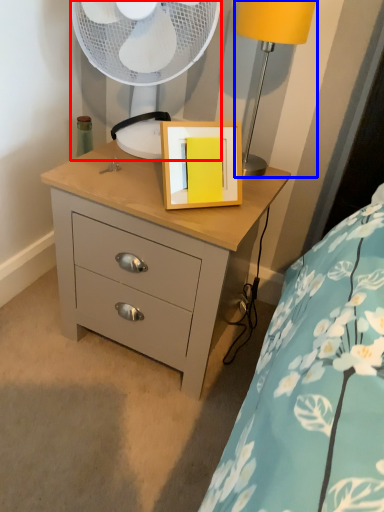
Question: Among these objects, which one is nearest to the camera, mechanical fan (highlighted by a red box) or table lamp (highlighted by a blue box)?

Choices:
 (A) mechanical fan
 (B) table lamp

Answer: (B)